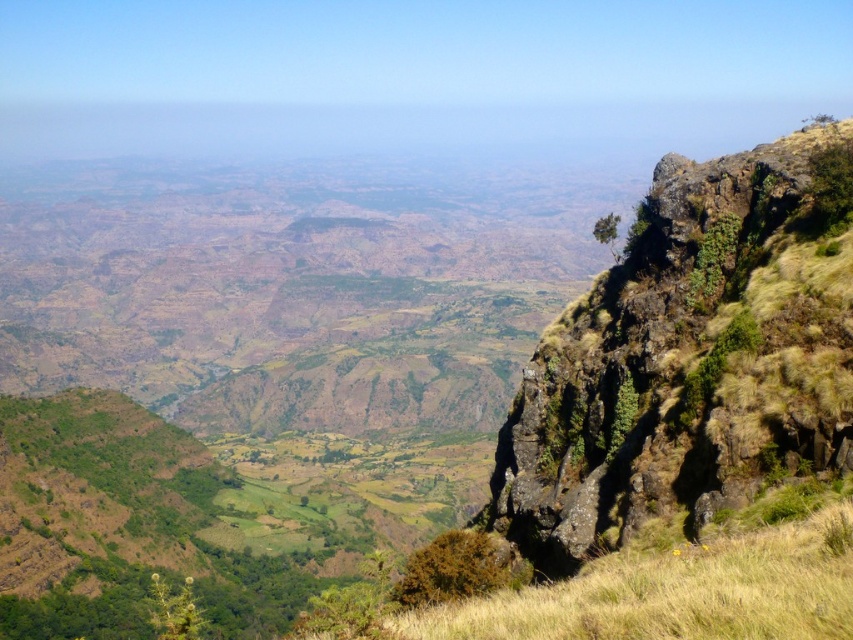
Question: Can you confirm if yellow grassy at right is thinner than green leafy bush at lower right?

Choices:
 (A) yes
 (B) no

Answer: (B)

Question: Which of the following is the farthest from the observer?

Choices:
 (A) green leafy bush at lower right
 (B) yellow grassy at right

Answer: (A)

Question: Observing the image, what is the correct spatial positioning of yellow grassy at right in reference to green leafy bush at lower right?

Choices:
 (A) left
 (B) right

Answer: (B)

Question: Does yellow grassy at right appear over green leafy bush at lower right?

Choices:
 (A) yes
 (B) no

Answer: (A)